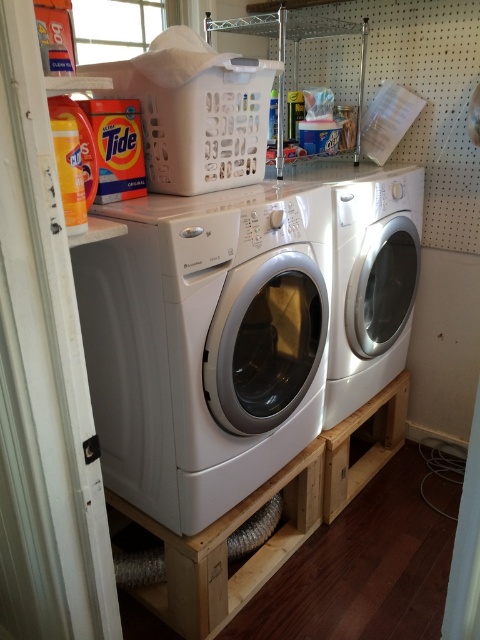
Which is more to the left, white glossy washer at left or wooden pallet at lower center?

wooden pallet at lower center

Between white glossy washer at left and wooden pallet at lower center, which one is positioned higher?

white glossy washer at left is higher up.

This screenshot has height=640, width=480. Find the location of `white glossy washer at left`. white glossy washer at left is located at coordinates (205, 342).

The height and width of the screenshot is (640, 480). Find the location of `white glossy washer at left`. white glossy washer at left is located at coordinates (205, 342).

Does white glossy washer at left have a larger size compared to white glossy washer at center?

Indeed, white glossy washer at left has a larger size compared to white glossy washer at center.

Does white glossy washer at left appear under white glossy washer at center?

Yes.

Is point (200, 310) farther from camera compared to point (383, 241)?

No, it is not.

Locate an element on the screen. This screenshot has width=480, height=640. white glossy washer at left is located at coordinates (205, 342).

Does white glossy washer at center appear on the right side of wooden pallet at lower center?

Correct, you'll find white glossy washer at center to the right of wooden pallet at lower center.

The image size is (480, 640). In order to click on white glossy washer at center in this screenshot , I will do `click(372, 282)`.

Describe the element at coordinates (372, 282) in the screenshot. I see `white glossy washer at center` at that location.

At what (x,y) coordinates should I click in order to perform the action: click on white glossy washer at center. Please return your answer as a coordinate pair (x, y). Looking at the image, I should click on (372, 282).